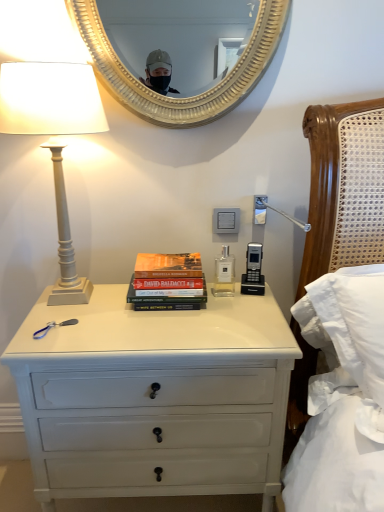
Question: Is gold textured mirror at upper center wider than hardcover books at center?

Choices:
 (A) yes
 (B) no

Answer: (B)

Question: Is gold textured mirror at upper center looking in the opposite direction of hardcover books at center?

Choices:
 (A) yes
 (B) no

Answer: (B)

Question: Is gold textured mirror at upper center at the right side of hardcover books at center?

Choices:
 (A) yes
 (B) no

Answer: (A)

Question: Does gold textured mirror at upper center have a greater height compared to hardcover books at center?

Choices:
 (A) yes
 (B) no

Answer: (A)

Question: Is gold textured mirror at upper center not close to hardcover books at center?

Choices:
 (A) yes
 (B) no

Answer: (A)

Question: Considering the relative positions of hardcover books at center and white painted wood chest of drawers at center in the image provided, is hardcover books at center to the left or to the right of white painted wood chest of drawers at center?

Choices:
 (A) left
 (B) right

Answer: (B)

Question: Considering the positions of hardcover books at center and white painted wood chest of drawers at center in the image, is hardcover books at center taller or shorter than white painted wood chest of drawers at center?

Choices:
 (A) tall
 (B) short

Answer: (B)

Question: Is point (193, 253) closer or farther from the camera than point (64, 381)?

Choices:
 (A) closer
 (B) farther

Answer: (B)

Question: Based on their sizes in the image, would you say hardcover books at center is bigger or smaller than white painted wood chest of drawers at center?

Choices:
 (A) small
 (B) big

Answer: (A)

Question: From a real-world perspective, is white painted wood chest of drawers at center physically located above or below gold textured mirror at upper center?

Choices:
 (A) above
 (B) below

Answer: (B)

Question: Do you think white painted wood chest of drawers at center is within gold textured mirror at upper center, or outside of it?

Choices:
 (A) inside
 (B) outside

Answer: (B)

Question: Is point (279, 452) positioned closer to the camera than point (243, 11)?

Choices:
 (A) farther
 (B) closer

Answer: (B)

Question: Would you say white painted wood chest of drawers at center is to the left or to the right of gold textured mirror at upper center in the picture?

Choices:
 (A) left
 (B) right

Answer: (A)

Question: Considering the positions of white painted wood chest of drawers at center and white plastic power outlet at center in the image, is white painted wood chest of drawers at center taller or shorter than white plastic power outlet at center?

Choices:
 (A) tall
 (B) short

Answer: (A)

Question: Is white painted wood chest of drawers at center spatially inside white plastic power outlet at center, or outside of it?

Choices:
 (A) outside
 (B) inside

Answer: (A)